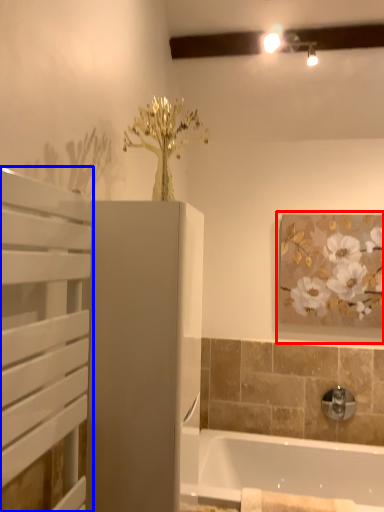
Question: Which point is closer to the camera, picture frame (highlighted by a red box) or screen door (highlighted by a blue box)?

Choices:
 (A) picture frame
 (B) screen door

Answer: (B)